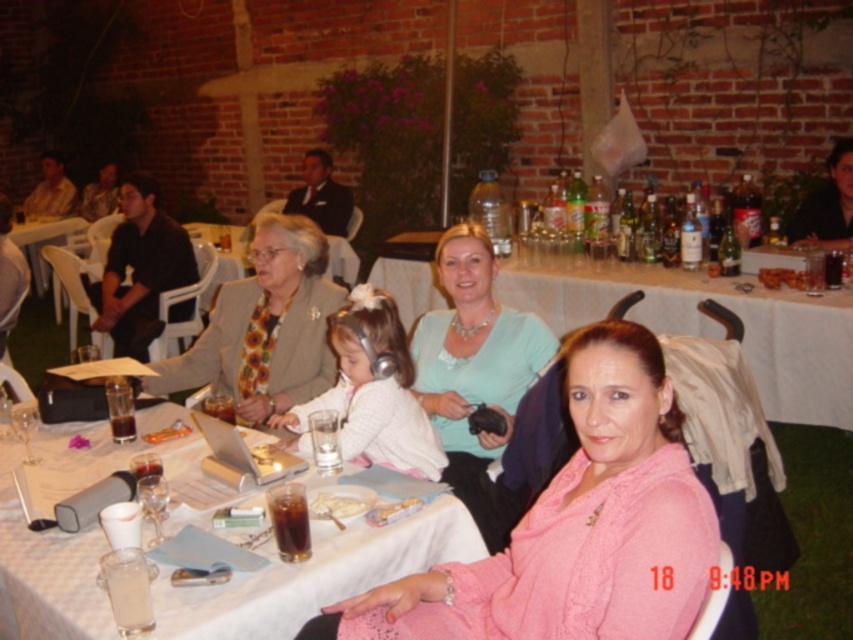
Question: Can you confirm if silver metallic laptop at center is bigger than white paper at center?

Choices:
 (A) no
 (B) yes

Answer: (B)

Question: Is black leather jacket at upper right to the left of white plastic table at lower left from the viewer's perspective?

Choices:
 (A) yes
 (B) no

Answer: (B)

Question: Which of the following is the farthest from the observer?

Choices:
 (A) (142, 438)
 (B) (447, 388)

Answer: (B)

Question: Can you confirm if white tablecloth at center is positioned below white creamy food at table center?

Choices:
 (A) yes
 (B) no

Answer: (B)

Question: Estimate the real-world distances between objects in this image. Which object is farther from the light blue fabric shirt at center?

Choices:
 (A) silver metallic laptop at center
 (B) white plastic table at lower left
 (C) pink fabric at center

Answer: (B)

Question: Estimate the real-world distances between objects in this image. Which object is closer to the orange plastic toy at center?

Choices:
 (A) white creamy food at table center
 (B) white paper table at center
 (C) pink fabric at center
 (D) black leather jacket at upper right

Answer: (B)